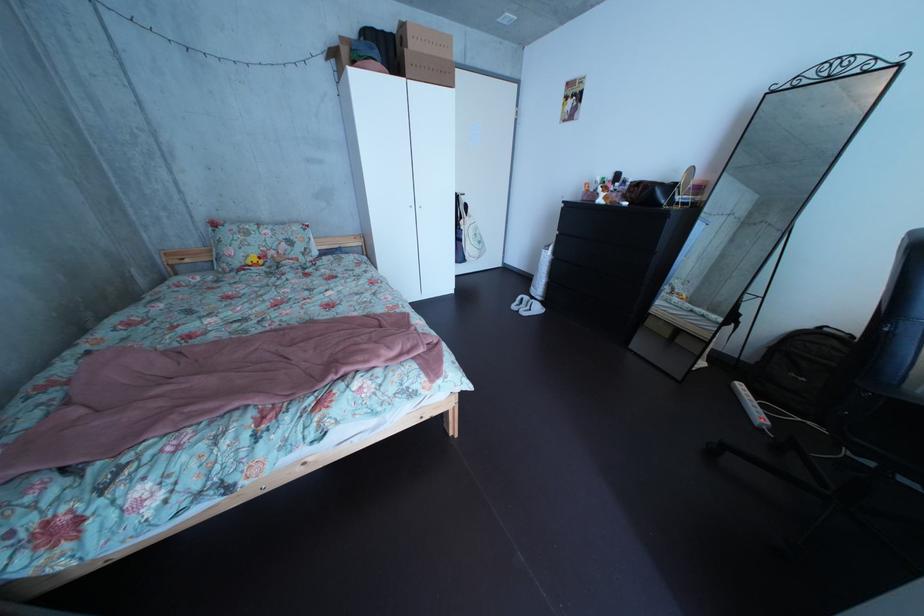
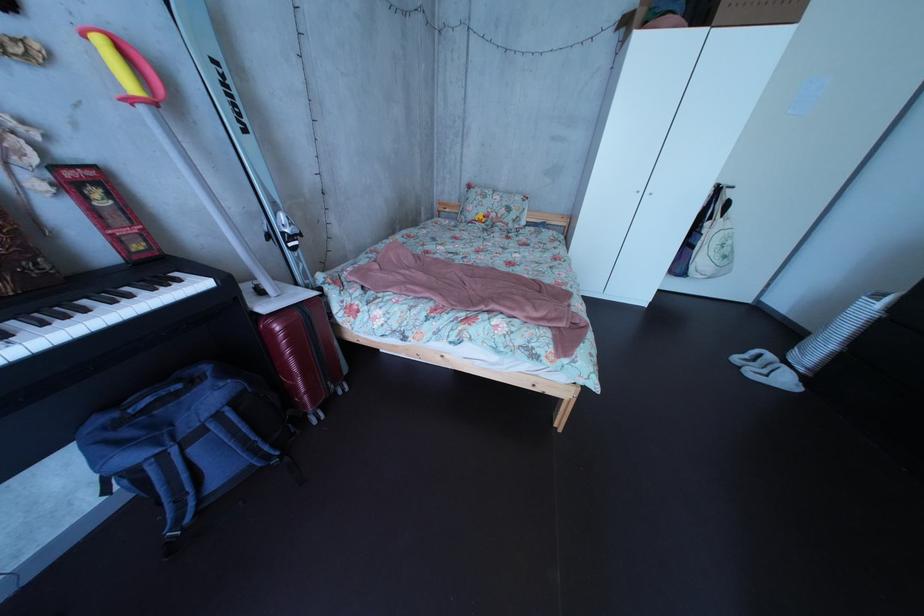
Find the pixel in the second image that matches point (263, 246) in the first image.

(499, 209)